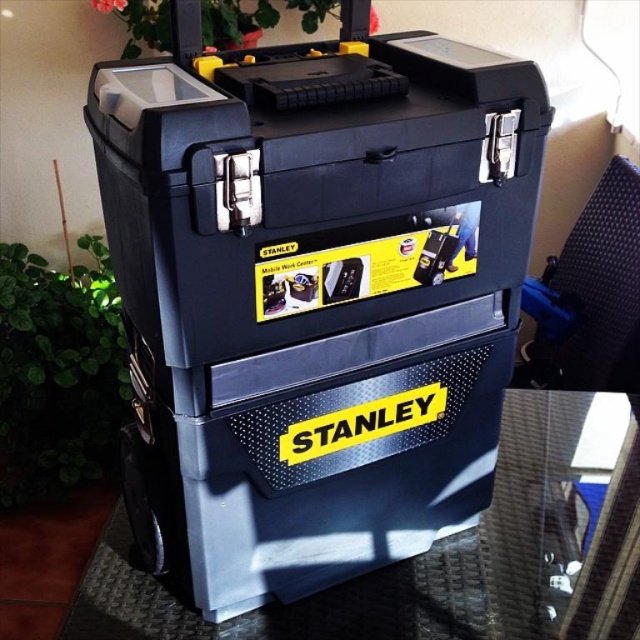
You are organizing your garage and have both the matte black toolbox at center and the transparent glass table at lower right. Which object should you choose if you need a larger storage container?

The matte black toolbox at center is bigger than the transparent glass table at lower right, so you should choose the matte black toolbox at center for larger storage needs.

You are organizing tools in a workshop and need to place the matte black toolbox at center and the transparent glass table at lower right. According to the image, which object is located to the left of the other?

The matte black toolbox at center is positioned on the left side of transparent glass table at lower right.